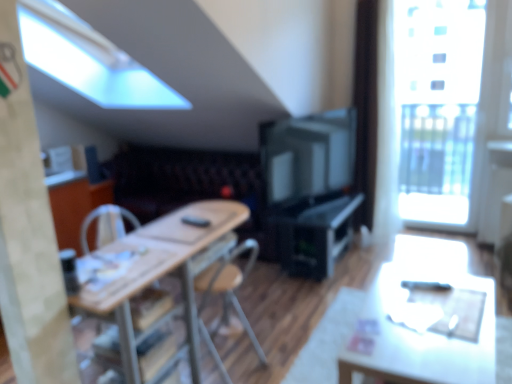
Question: From the image's perspective, relative to matte white table at lower right, is black plastic remote control at center above or below?

Choices:
 (A) below
 (B) above

Answer: (B)

Question: In the image, is black plastic remote control at center on the left side or the right side of matte white table at lower right?

Choices:
 (A) right
 (B) left

Answer: (B)

Question: Considering the real-world distances, which object is farthest from the black plastic computer desk at center?

Choices:
 (A) transparent glass window at upper right
 (B) wooden table at center
 (C) matte white table at lower right
 (D) black plastic remote control at center
 (E) white fabric armchair at center

Answer: (D)

Question: Which is nearer to the wooden at left, arranged as the first chair when viewed from the back?

Choices:
 (A) wooden chair at center, which appears as the 2th chair when viewed from the back
 (B) matte black television at center
 (C) velvet dark brown couch at center
 (D) wooden table at center
 (E) black plastic remote control at center

Answer: (A)